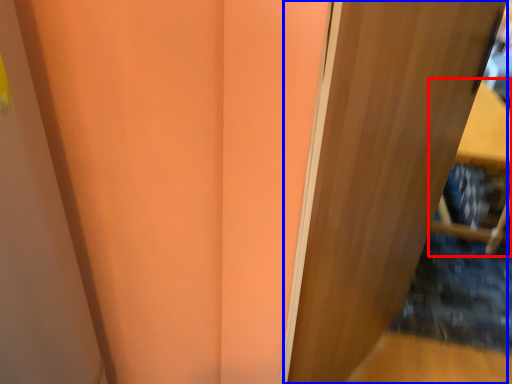
Question: Which object appears closest to the camera in this image, furniture (highlighted by a red box) or door (highlighted by a blue box)?

Choices:
 (A) furniture
 (B) door

Answer: (B)